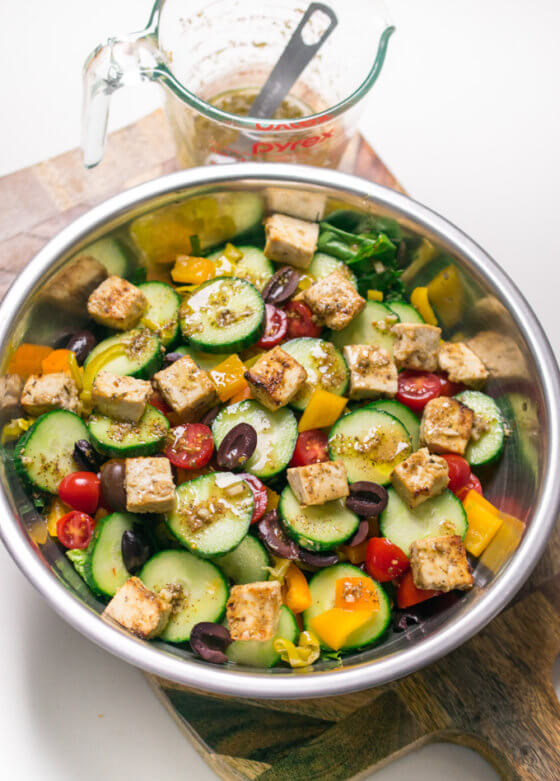
You are a GUI agent. You are given a task and a screenshot of the screen. Output one action in this format:
    pyautogui.click(x=<x>, y=<y>)
    Task: Click on the white table
    The width and height of the screenshot is (560, 781).
    Given the screenshot: What is the action you would take?
    pyautogui.click(x=67, y=740)